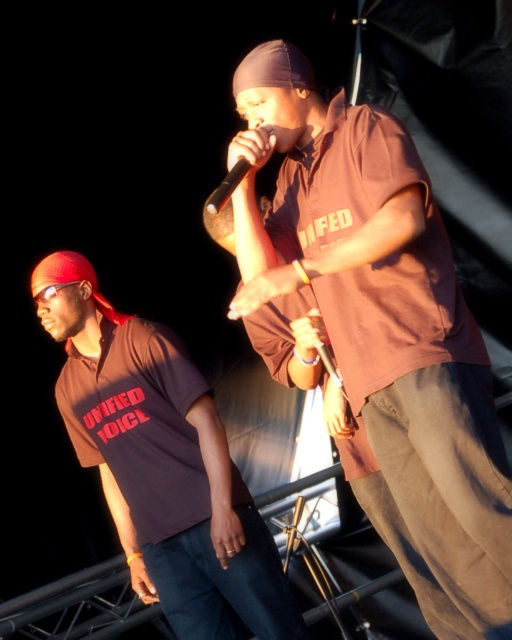
Question: Among these objects, which one is farthest from the camera?

Choices:
 (A) brown matte shirt at center
 (B) matte brown shirt at center

Answer: (B)

Question: Which object is the farthest from the black matte microphone at center?

Choices:
 (A) matte brown shirt at center
 (B) brown matte shirt at center

Answer: (A)

Question: Does matte brown shirt at center have a lesser width compared to black matte microphone at center?

Choices:
 (A) yes
 (B) no

Answer: (B)

Question: Which object appears farthest from the camera in this image?

Choices:
 (A) black matte microphone at center
 (B) brown matte shirt at center

Answer: (A)

Question: Does brown matte shirt at center appear on the left side of matte brown shirt at center?

Choices:
 (A) yes
 (B) no

Answer: (B)

Question: Is brown matte shirt at center closer to the viewer compared to matte brown shirt at center?

Choices:
 (A) yes
 (B) no

Answer: (A)